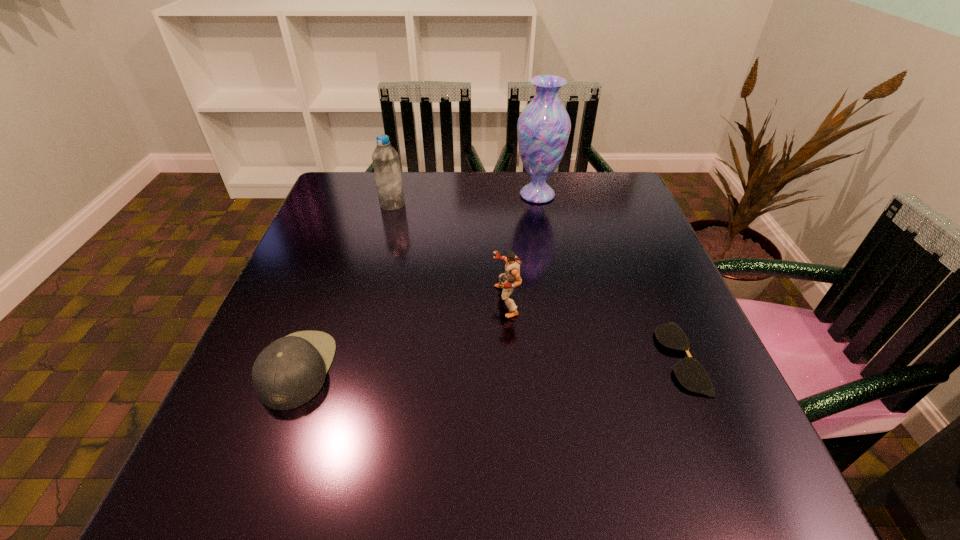
Where is `object that is at the far left corner`? The image size is (960, 540). object that is at the far left corner is located at coordinates (385, 158).

Where is `free space at the far edge of the desktop`? This screenshot has width=960, height=540. free space at the far edge of the desktop is located at coordinates (523, 183).

Image resolution: width=960 pixels, height=540 pixels. I want to click on free space at the near edge of the desktop, so click(407, 462).

The width and height of the screenshot is (960, 540). In order to click on free region at the left edge of the desktop in this screenshot , I will do `click(316, 229)`.

This screenshot has height=540, width=960. I want to click on vacant area at the right edge, so click(x=633, y=319).

Where is `vacant region at the far left corner of the desktop`? The height and width of the screenshot is (540, 960). vacant region at the far left corner of the desktop is located at coordinates (350, 192).

In the image, there is a desktop. Identify the location of vacant space at the far right corner. (593, 177).

The image size is (960, 540). I want to click on vacant space at the near right corner of the desktop, so click(716, 510).

Locate an element on the screen. The width and height of the screenshot is (960, 540). vacant space that is in between the fourth shortest object and the shortest object is located at coordinates (536, 281).

Locate an element on the screen. vacant space that's between the tallest object and the second tallest object is located at coordinates (465, 200).